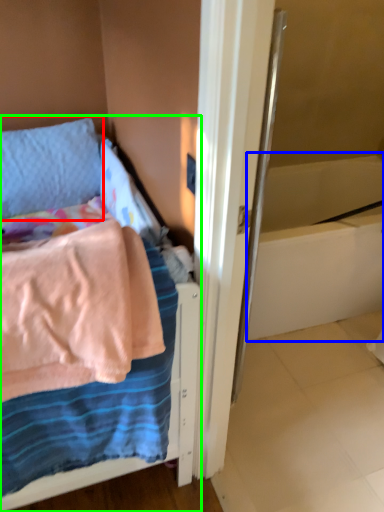
Question: Which object is positioned farthest from pillow (highlighted by a red box)? Select from bath (highlighted by a blue box) and bed (highlighted by a green box).

Choices:
 (A) bath
 (B) bed

Answer: (A)